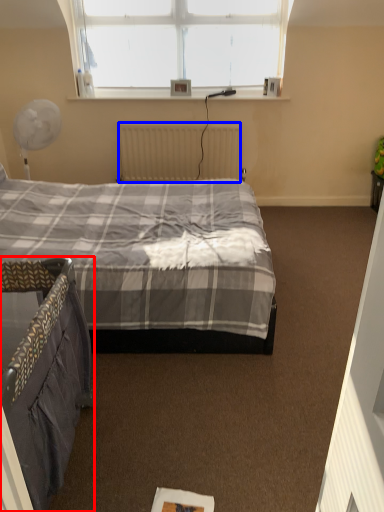
Question: Which point is further to the camera, bed (highlighted by a red box) or radiator (highlighted by a blue box)?

Choices:
 (A) bed
 (B) radiator

Answer: (B)